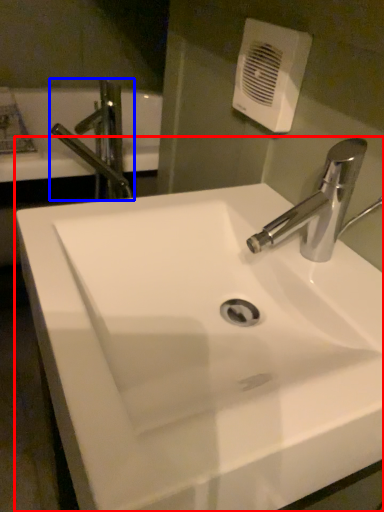
Question: Among these objects, which one is nearest to the camera, sink (highlighted by a red box) or tap (highlighted by a blue box)?

Choices:
 (A) sink
 (B) tap

Answer: (A)